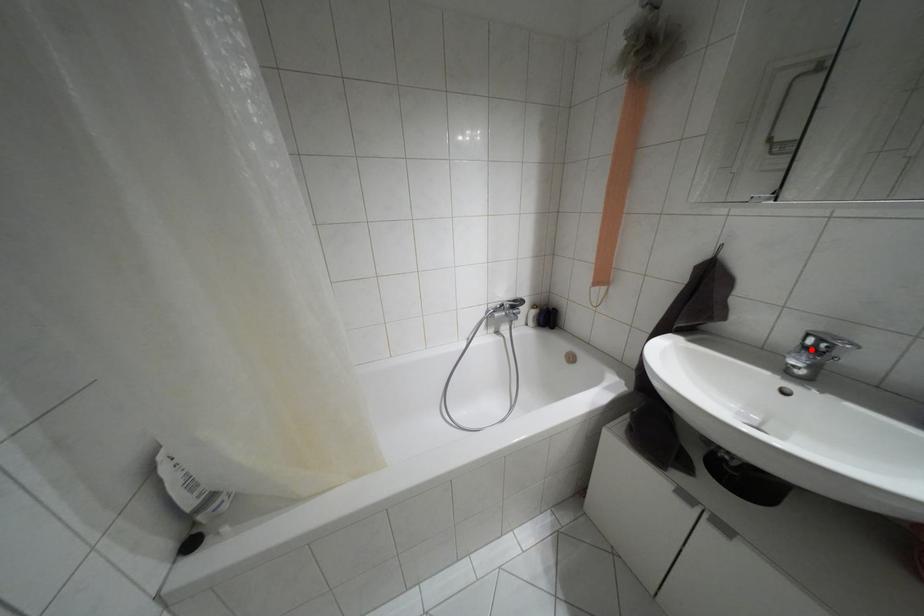
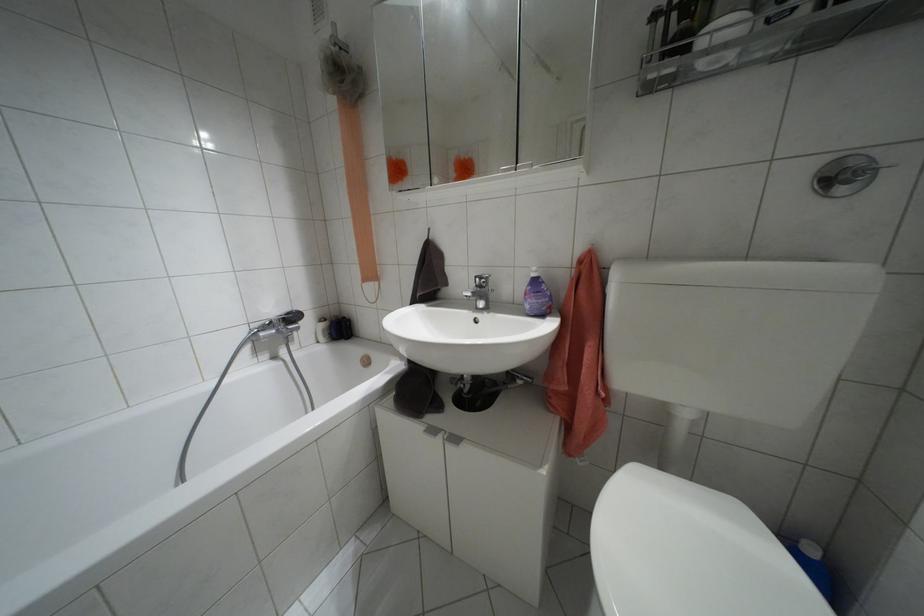
Question: I am providing you with two images of the same scene from different viewpoints. A red point is marked on the first image. Can you still see the location of the red point in image 2?

Choices:
 (A) Yes
 (B) No

Answer: (A)